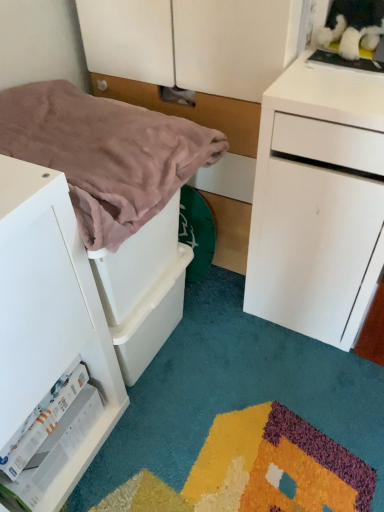
Question: In terms of size, does white matte drawer at left appear bigger or smaller than pink soft blanket at left?

Choices:
 (A) small
 (B) big

Answer: (B)

Question: Does point (39, 507) appear closer or farther from the camera than point (112, 185)?

Choices:
 (A) closer
 (B) farther

Answer: (B)

Question: Based on their relative distances, which object is nearer to the matte white dresser at center?

Choices:
 (A) white matte drawer at left
 (B) pink soft blanket at left

Answer: (B)

Question: Considering the real-world distances, which object is farthest from the pink soft blanket at left?

Choices:
 (A) matte white dresser at center
 (B) white matte drawer at left

Answer: (A)